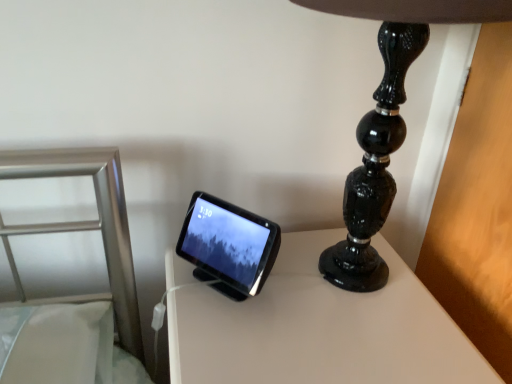
Find the location of a particular element. vacant space that's between black glossy lamp at upper right and matte black tablet at center is located at coordinates (240, 314).